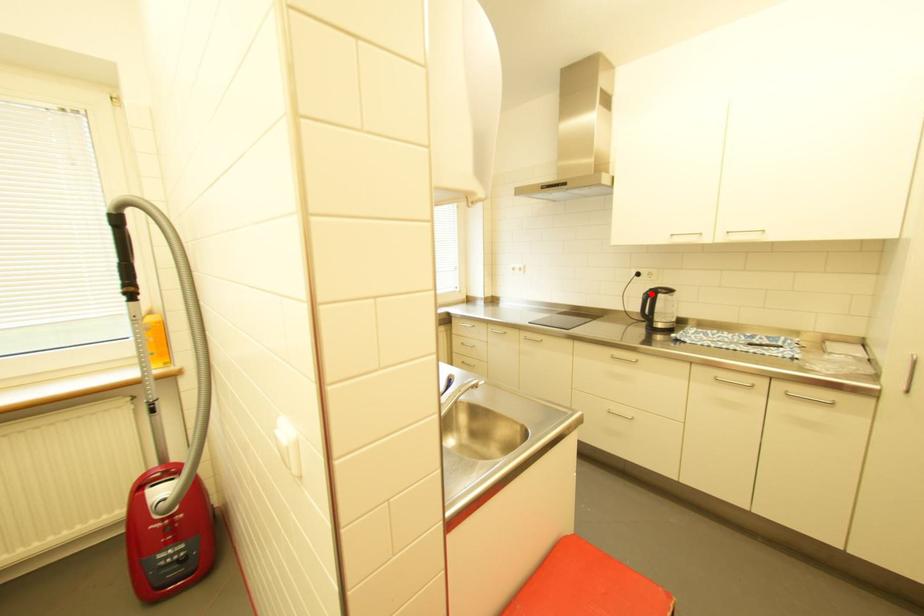
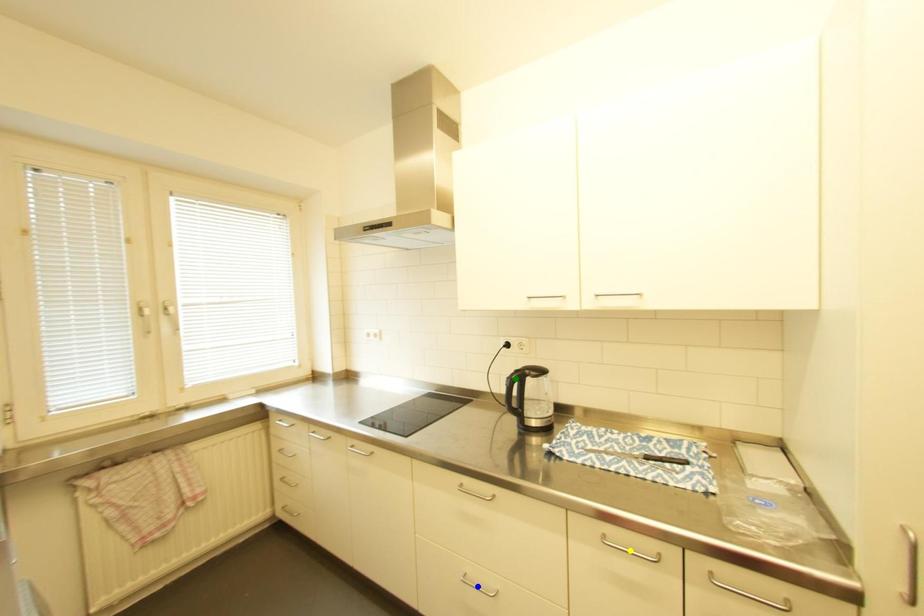
Question: I am providing you with two images of the same scene from different viewpoints. A red point is marked on the first image. You are given multiple points on the second image. Can you choose the point in image 2 that corresponds to the point in image 1?

Choices:
 (A) blue point
 (B) green point
 (C) yellow point

Answer: (B)